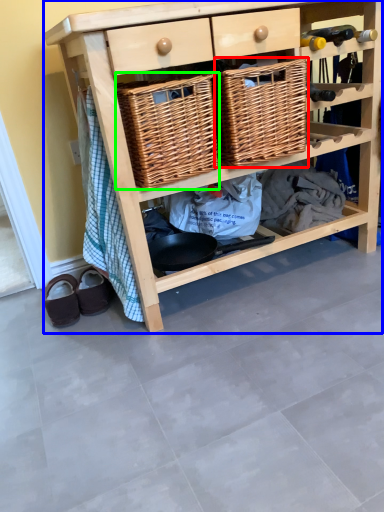
Question: Considering the real-world distances, which object is farthest from basket (highlighted by a red box)? shelf (highlighted by a blue box) or basket (highlighted by a green box)?

Choices:
 (A) shelf
 (B) basket

Answer: (A)